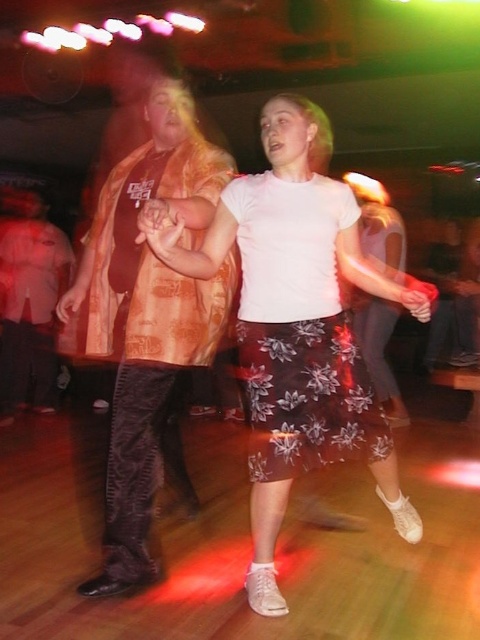
You are standing at the entrance of the dance hall and see two points marked in the scene. The first point is at coordinate point (312, 156) and the second is at point (28, 234). Which point is closer to you?

Point (312, 156) is in front of point (28, 234), so it is closer to you.

In the scene shown: You are a photographer at the dance hall and want to capture the white matte skirt at center and the brown floral skirt at center in a single shot. Which skirt is positioned lower in the frame?

The white matte skirt at center is positioned below the brown floral skirt at center, so it is lower in the frame.

You are a photographer at the dance hall and want to capture a photo of the brown floral skirt at center and the matte orange shirt at left. Based on their positions, which object should you focus on first to ensure both are in the frame?

The brown floral skirt at center is positioned under the matte orange shirt at left, so you should focus on the matte orange shirt at left first to ensure both are in the frame.